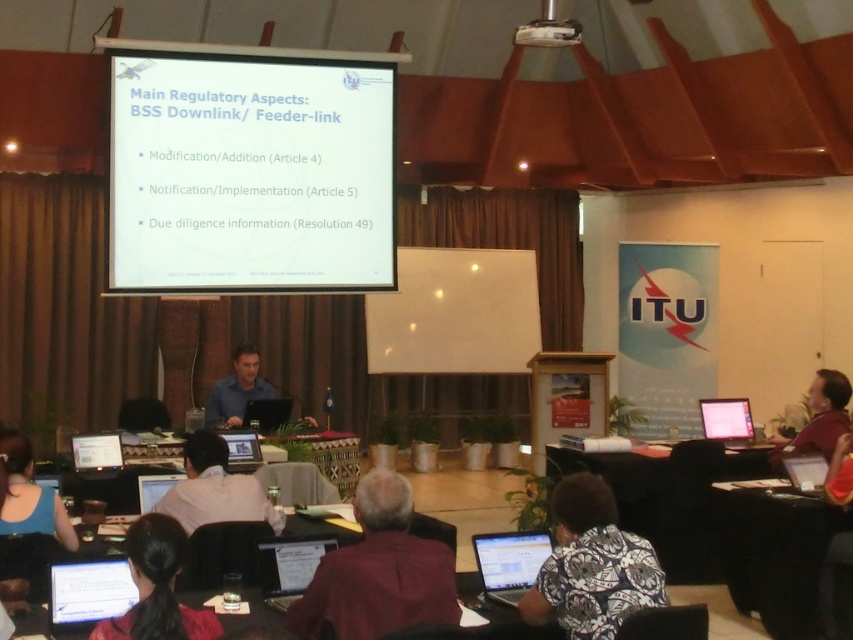
Question: Which of the following is the farthest from the observer?

Choices:
 (A) white shirt at center
 (B) white glossy projector screen at upper center
 (C) blue fabric shirt at lower left

Answer: (B)

Question: Does white paper at center lie behind white glossy laptop at right?

Choices:
 (A) no
 (B) yes

Answer: (A)

Question: Does dark red shirt at lower right appear under white plastic projector at upper center?

Choices:
 (A) yes
 (B) no

Answer: (A)

Question: Can you confirm if matte black screen at lower center is bigger than dark red shirt at lower right?

Choices:
 (A) no
 (B) yes

Answer: (A)

Question: Which object is the farthest from the black hair at lower center?

Choices:
 (A) white glossy projector screen at upper center
 (B) white shirt at center

Answer: (A)

Question: Which point is closer to the camera taking this photo?

Choices:
 (A) (379, 112)
 (B) (76, 598)
 (C) (229, 509)
 (D) (299, 540)

Answer: (B)